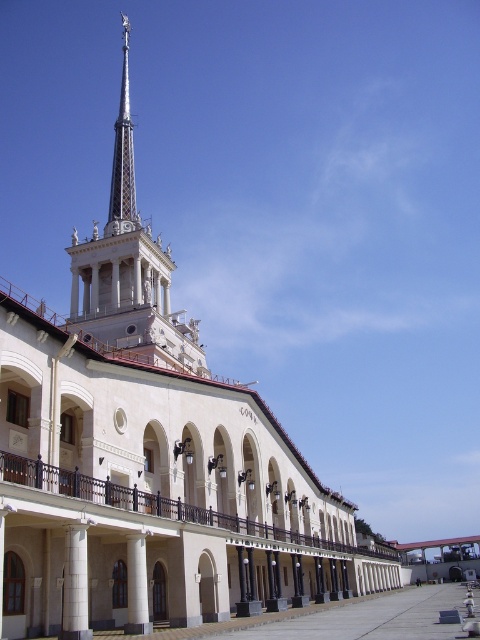
Question: Among these objects, which one is nearest to the camera?

Choices:
 (A) white smooth pillar at center
 (B) white stone column at lower left

Answer: (B)

Question: Where is white stone column at lower left located in relation to white smooth pillar at center in the image?

Choices:
 (A) left
 (B) right

Answer: (A)

Question: Which object is farther from the camera taking this photo?

Choices:
 (A) white stone column at lower left
 (B) white smooth pillar at center

Answer: (B)

Question: Is white stone column at lower left below white smooth pillar at center?

Choices:
 (A) no
 (B) yes

Answer: (A)

Question: Can you confirm if white stone column at lower left is smaller than white smooth pillar at center?

Choices:
 (A) no
 (B) yes

Answer: (A)

Question: Which object appears farthest from the camera in this image?

Choices:
 (A) white stone column at lower left
 (B) white smooth pillar at center

Answer: (B)